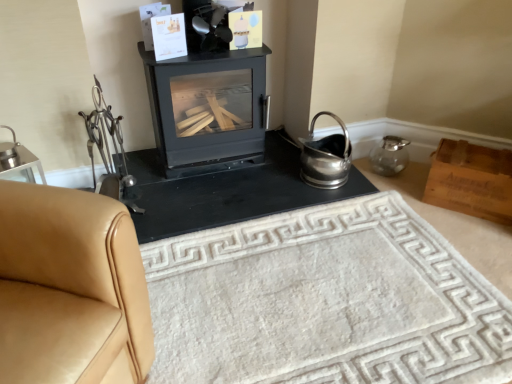
Where is `free point to the right of black matte wood burning stove at center`? The image size is (512, 384). free point to the right of black matte wood burning stove at center is located at coordinates (279, 160).